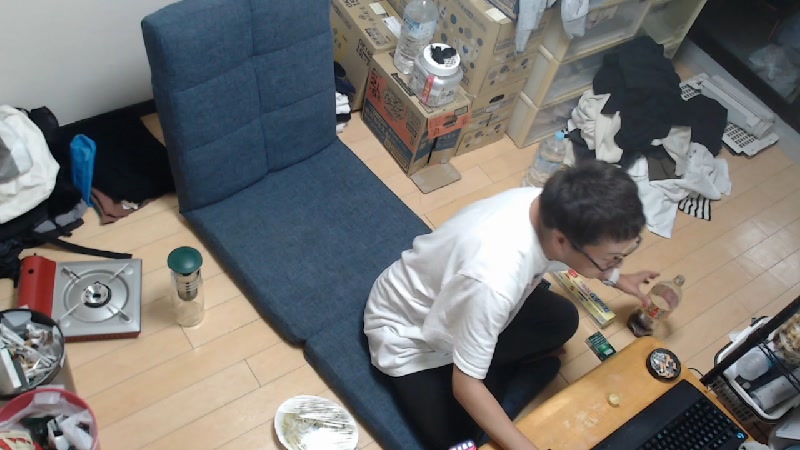
Locate an element on the screen. sponge is located at coordinates (334, 271), (352, 360).